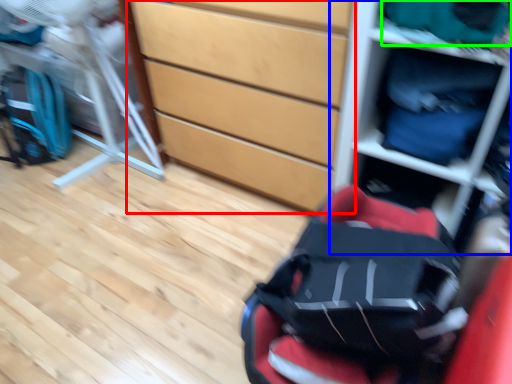
Question: Which object is the closest to the chest of drawers (highlighted by a red box)? Choose among these: shelf (highlighted by a blue box) or clothing (highlighted by a green box).

Choices:
 (A) shelf
 (B) clothing

Answer: (A)